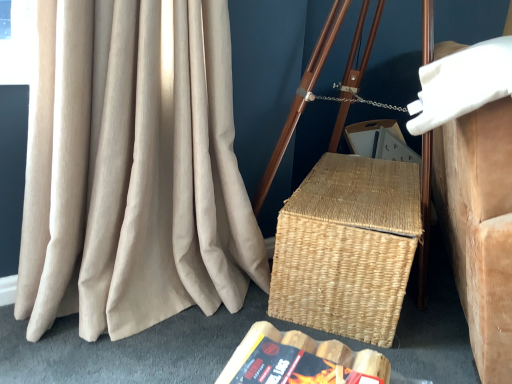
Find the location of a particular element. Image resolution: width=512 pixels, height=384 pixels. vacant area on top of hardcover book at lower center (from a real-world perspective) is located at coordinates (298, 369).